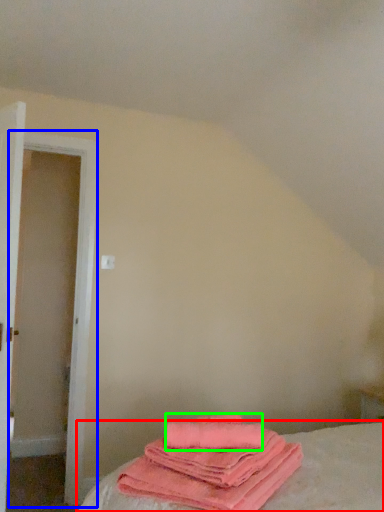
Question: Which is nearer to the bed (highlighted by a red box)? door (highlighted by a blue box) or beach towel (highlighted by a green box).

Choices:
 (A) door
 (B) beach towel

Answer: (B)